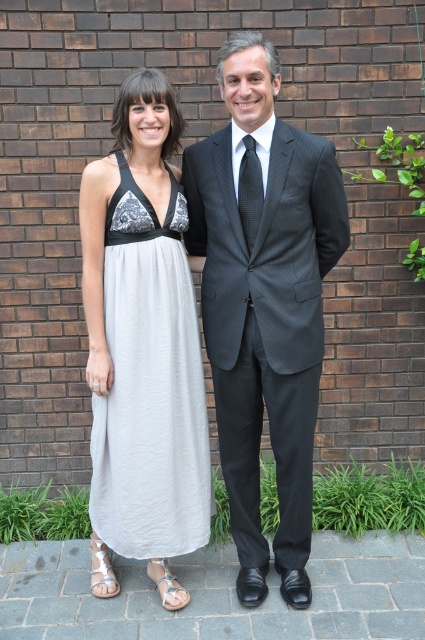
You are a photographer setting up for a photoshoot. You need to position the dark gray suit at center and the light gray cotton dress at center in a way that the dark gray suit is on the right side of the light gray cotton dress. Based on the scene description, is the current arrangement correct?

Yes, the current arrangement is correct because the dark gray suit at center is positioned on the right side of light gray cotton dress at center as required.

You are a photographer trying to capture a group photo of the dark gray suit at center and the light gray cotton dress at center. Since you want to ensure that both subjects are visible in the frame, which subject should you position closer to the camera to maintain their visibility?

The light gray cotton dress at center should be positioned closer to the camera because it is shorter than the dark gray suit at center, ensuring both are visible in the frame.